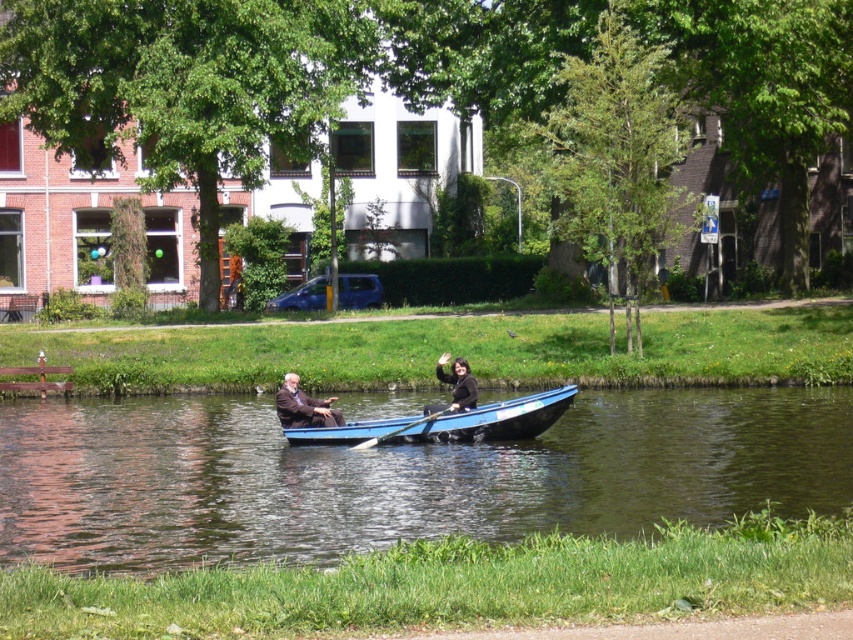
Question: Does blue polished wood canoe at center have a larger size compared to dark brown leather jacket at center?

Choices:
 (A) no
 (B) yes

Answer: (B)

Question: Does dark brown leather jacket at center have a lesser width compared to black fabric jacket at center?

Choices:
 (A) yes
 (B) no

Answer: (B)

Question: Can you confirm if blue polished wood canoe at center is positioned below dark brown leather jacket at center?

Choices:
 (A) yes
 (B) no

Answer: (A)

Question: Which point appears closest to the camera in this image?

Choices:
 (A) (438, 360)
 (B) (315, 408)
 (C) (212, 538)

Answer: (C)

Question: Which point is farther to the camera?

Choices:
 (A) (286, 378)
 (B) (498, 436)
 (C) (461, 356)
 (D) (361, 416)

Answer: (D)

Question: Which point appears farthest from the camera in this image?

Choices:
 (A) (471, 408)
 (B) (680, 474)
 (C) (300, 394)

Answer: (C)